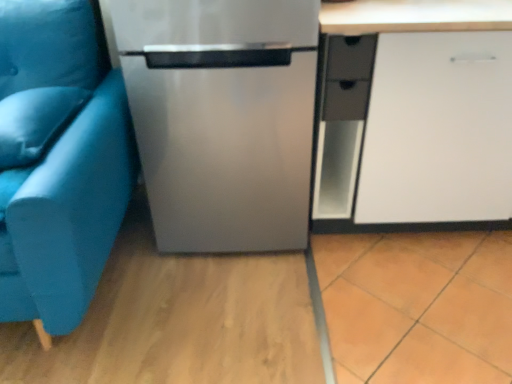
Question: Is satin blue pillow at left not inside matte black drawer at center right?

Choices:
 (A) yes
 (B) no

Answer: (A)

Question: From the image's perspective, is satin blue pillow at left over matte black drawer at center right?

Choices:
 (A) yes
 (B) no

Answer: (B)

Question: From a real-world perspective, is satin blue pillow at left located higher than matte black drawer at center right?

Choices:
 (A) yes
 (B) no

Answer: (A)

Question: Is satin blue pillow at left at the left side of matte black drawer at center right?

Choices:
 (A) yes
 (B) no

Answer: (A)

Question: Is satin blue pillow at left wider than matte black drawer at center right?

Choices:
 (A) yes
 (B) no

Answer: (A)

Question: Is satin blue pillow at left at the right side of matte black drawer at center right?

Choices:
 (A) yes
 (B) no

Answer: (B)

Question: From a real-world perspective, is satin blue pillow at left physically above stainless steel refrigerator at center?

Choices:
 (A) yes
 (B) no

Answer: (A)

Question: Does satin blue pillow at left have a smaller size compared to stainless steel refrigerator at center?

Choices:
 (A) no
 (B) yes

Answer: (B)

Question: From a real-world perspective, is satin blue pillow at left beneath stainless steel refrigerator at center?

Choices:
 (A) no
 (B) yes

Answer: (A)

Question: Is satin blue pillow at left in contact with stainless steel refrigerator at center?

Choices:
 (A) no
 (B) yes

Answer: (A)

Question: Is satin blue pillow at left positioned far away from stainless steel refrigerator at center?

Choices:
 (A) no
 (B) yes

Answer: (A)

Question: Can we say satin blue pillow at left lies outside stainless steel refrigerator at center?

Choices:
 (A) no
 (B) yes

Answer: (B)

Question: Considering the relative positions of stainless steel refrigerator at center and teal fabric studio couch at left in the image provided, is stainless steel refrigerator at center behind teal fabric studio couch at left?

Choices:
 (A) yes
 (B) no

Answer: (A)